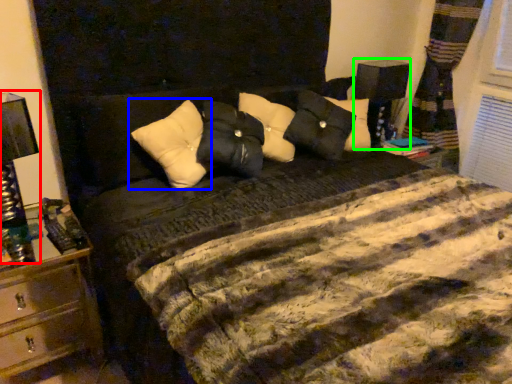
Question: Which is nearer to the bedside lamp (highlighted by a red box)? pillow (highlighted by a blue box) or bedside lamp (highlighted by a green box).

Choices:
 (A) pillow
 (B) bedside lamp

Answer: (A)